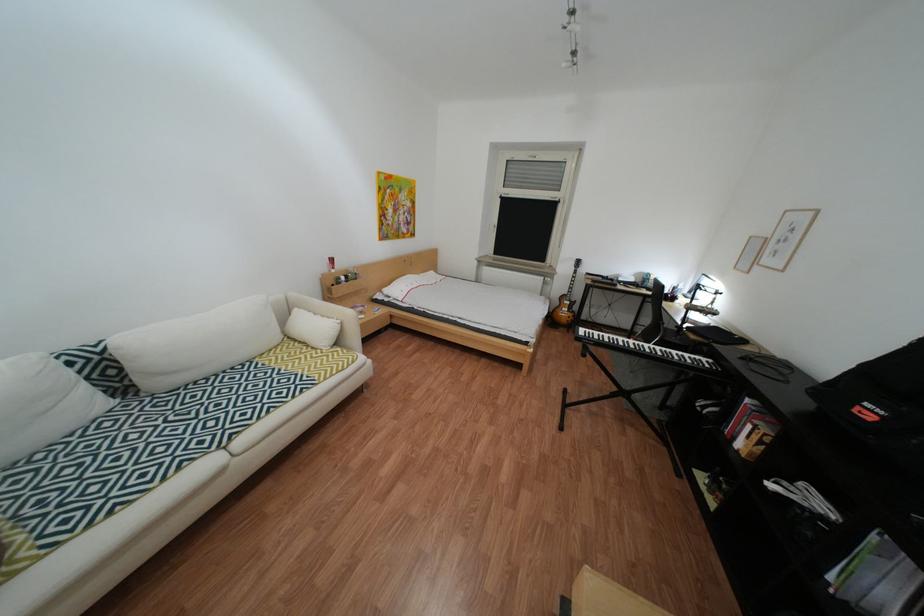
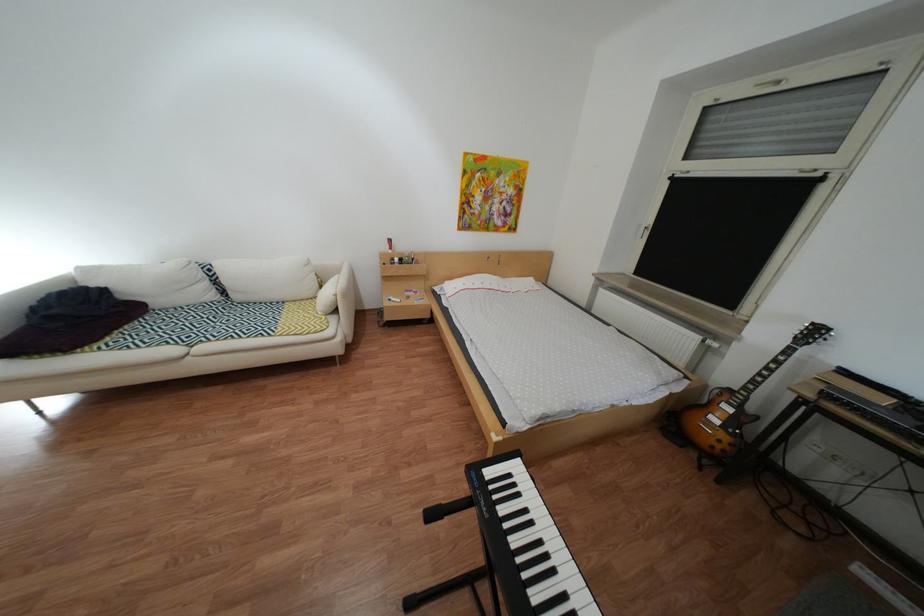
The point at (100,384) is marked in the first image. Where is the corresponding point in the second image?

(223, 284)